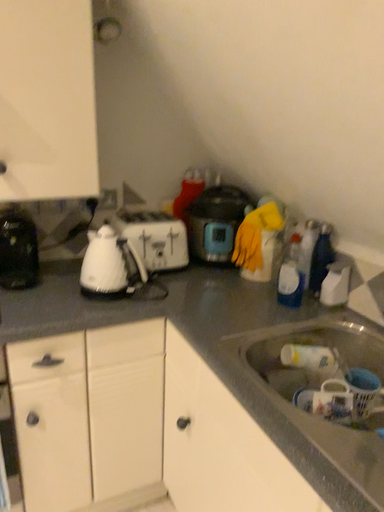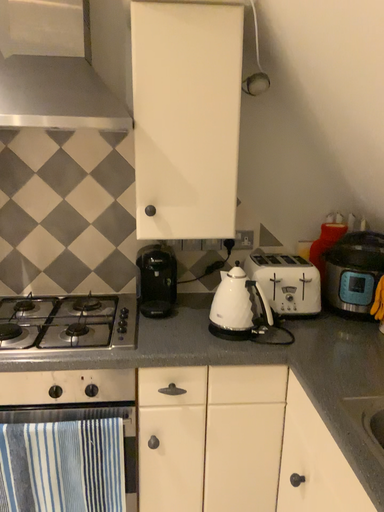
Question: Which way did the camera rotate in the video?

Choices:
 (A) rotated right
 (B) rotated left

Answer: (B)